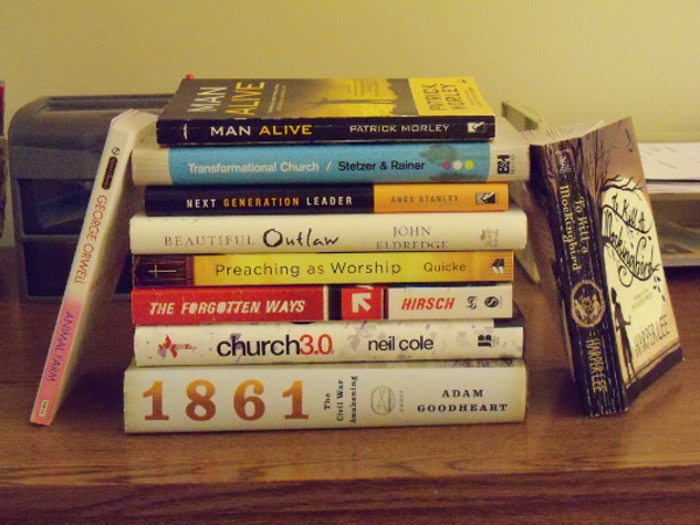
Locate an element on the screen. The height and width of the screenshot is (525, 700). books is located at coordinates (593, 278), (88, 271), (365, 391), (382, 343), (388, 302), (386, 273), (385, 237), (367, 195), (393, 154), (410, 130).